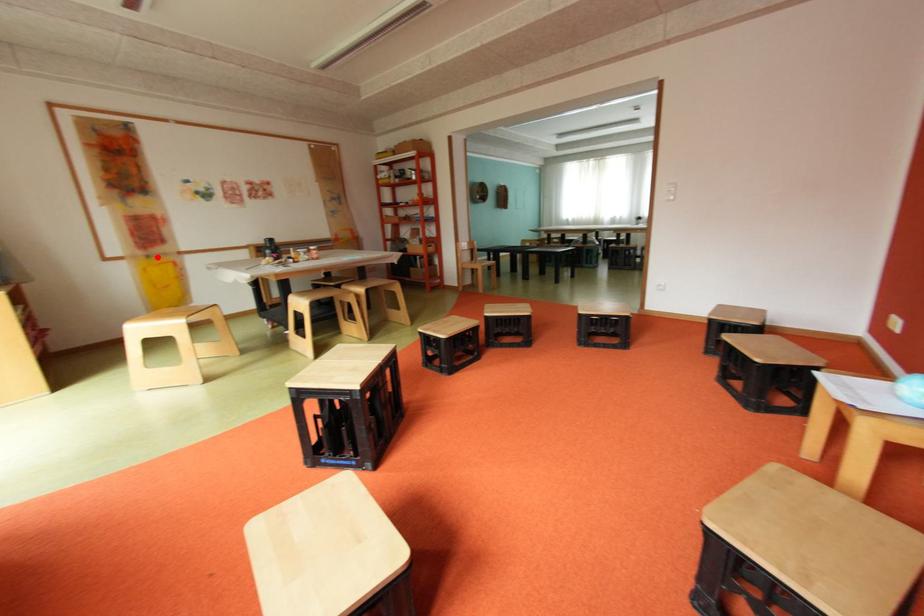
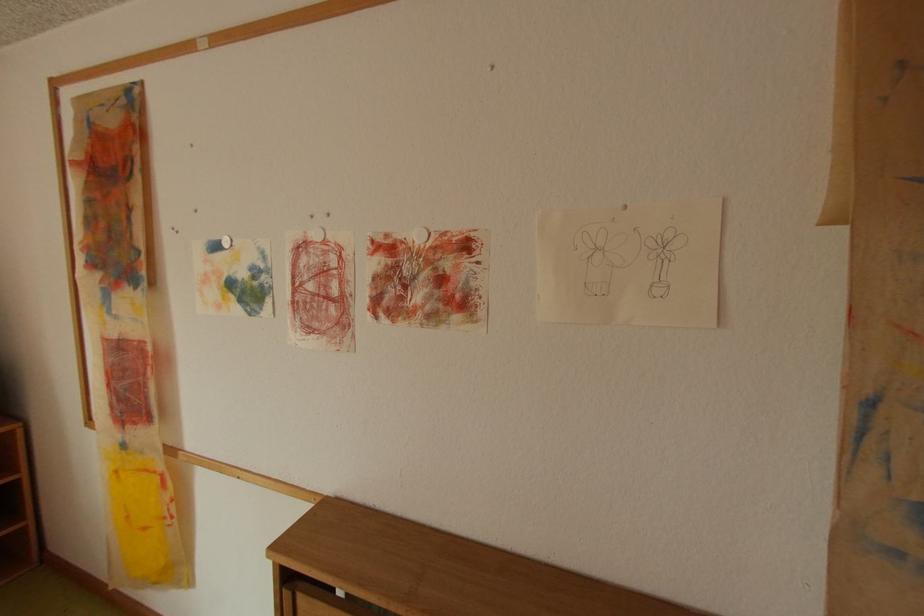
Locate, in the second image, the point that corresponds to the highlighted location in the first image.

(134, 446)